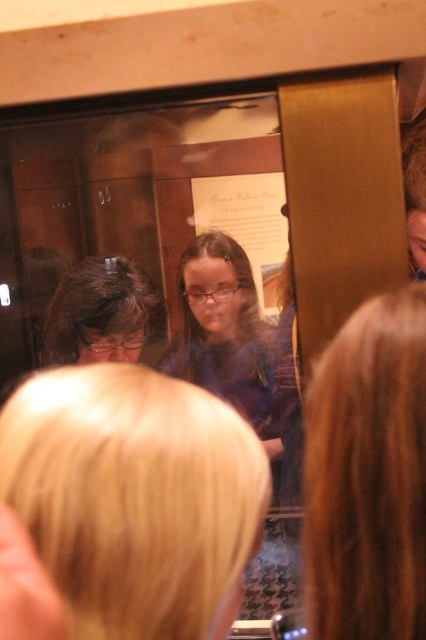
You are standing in the room and see two points marked in the image. One is at position point (339, 627) and the other at point (49, 337). Which point is closer to you?

Point (339, 627) is closer to the viewer than point (49, 337).

You are organizing a photo shoot and need to ensure that the blonde hair at upper center and the purple fabric at center are both visible in the frame. Based on their sizes, which object should you prioritize keeping in focus to avoid blurring?

The blonde hair at upper center is smaller than the purple fabric at center, so you should prioritize keeping the purple fabric at center in focus since it is larger and more likely to remain sharp in the photo.